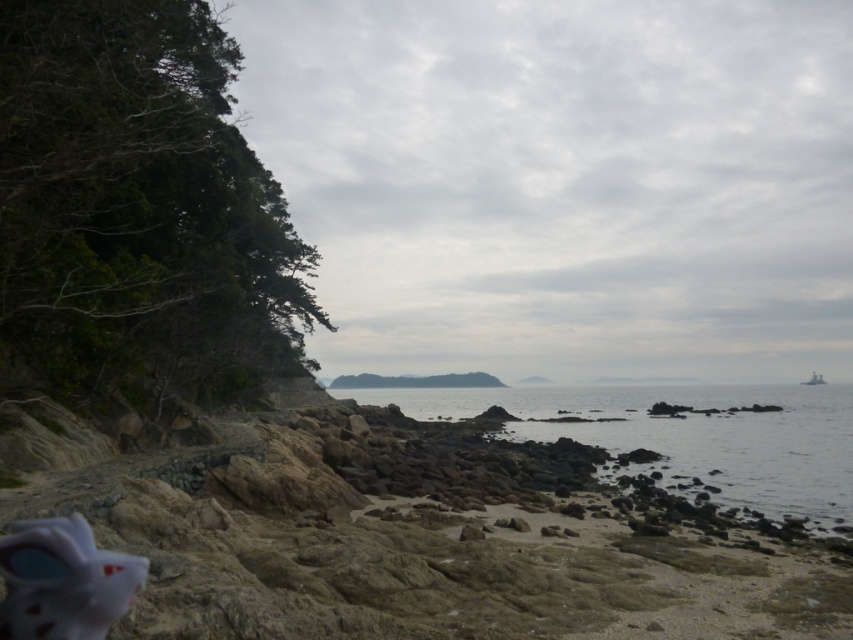
Question: Which point is farther from the camera taking this photo?

Choices:
 (A) (16, 426)
 (B) (729, 433)

Answer: (B)

Question: Is rocky beach at lower left below clear water at center?

Choices:
 (A) yes
 (B) no

Answer: (B)

Question: Among these objects, which one is farthest from the camera?

Choices:
 (A) clear water at center
 (B) rocky beach at lower left

Answer: (A)

Question: Does rocky beach at lower left appear under clear water at center?

Choices:
 (A) yes
 (B) no

Answer: (B)

Question: Does rocky beach at lower left have a larger size compared to clear water at center?

Choices:
 (A) no
 (B) yes

Answer: (A)